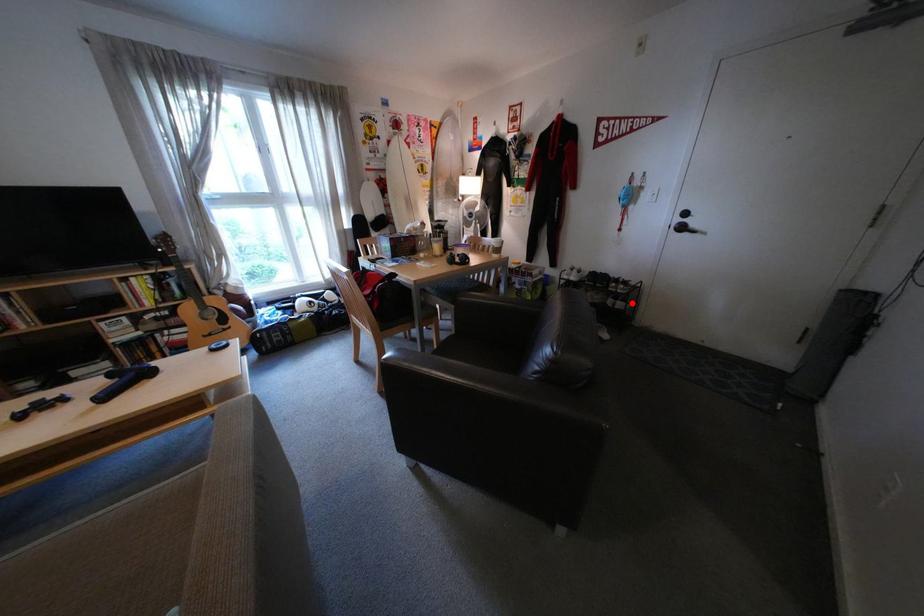
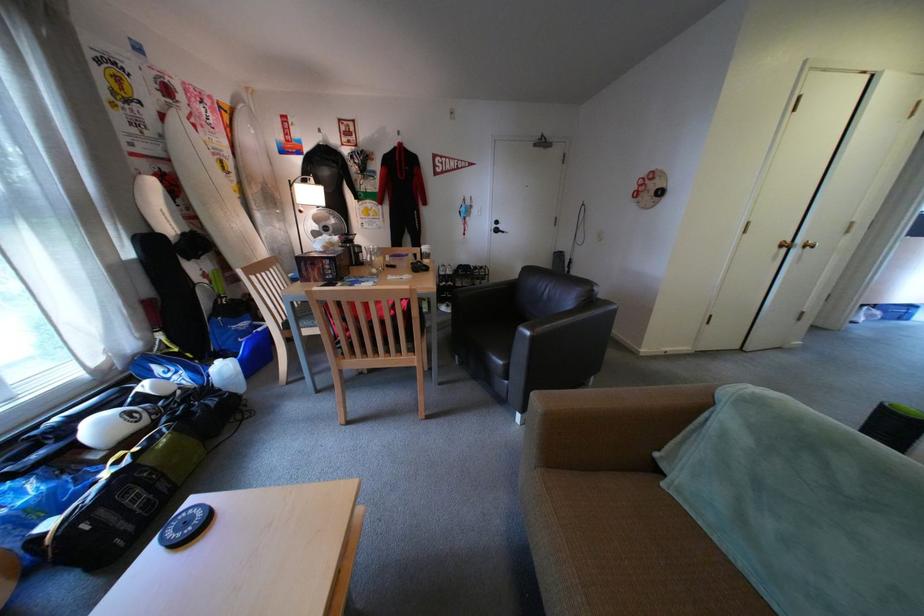
Question: A red point is marked in image1. In image2, is the corresponding 3D point closer to the camera or farther? Reply with the corresponding letter.

Choices:
 (A) The corresponding 3D point is closer.
 (B) The corresponding 3D point is farther.

Answer: (B)